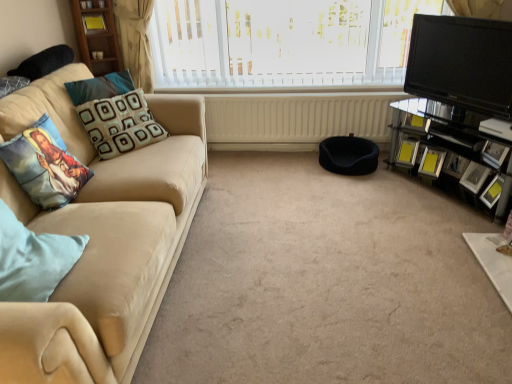
Identify the location of free location to the left of black fabric footrest at center. (300, 168).